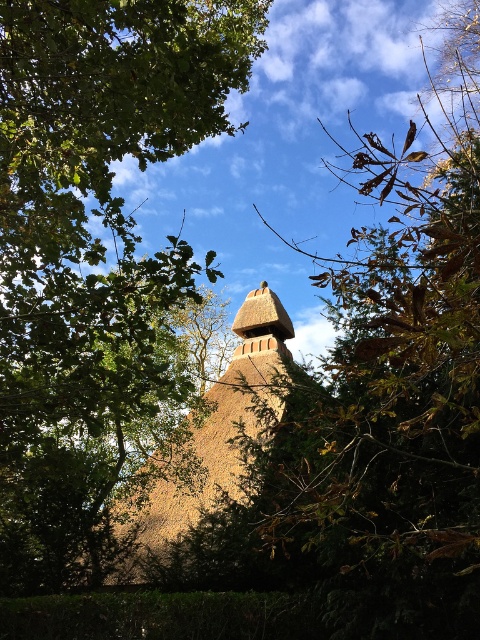
You are standing in front of the rustic thatched structure and notice two points marked on the image. The first point is at coordinate point [365,636] and the second is at point [180,515]. Which point is nearer to you?

Point [365,636] is closer to the viewer than point [180,515].

You are an architect designing a garden path that must pass between the green leafy tree at upper left and the brown thatched hut at center. The path must be wide enough to allow a wheelbarrow to pass through. Knowing that a standard wheelbarrow requires at least 1.2 meters of width, can the path between them accommodate this requirement?

The green leafy tree at upper left has a larger width than the brown thatched hut at center. However, the description does not provide specific measurements for the distance between them, so it is impossible to determine if the path is wide enough for a wheelbarrow.

You are standing in the middle of the image and want to locate the brown textured chimney at center. In which direction should you look to find it?

The brown textured chimney at center is located at the point with coordinates 0.623 on the x axis and 0.810 on the y axis. Since you are standing in the middle of the image, you should look towards the right and upwards to find it.